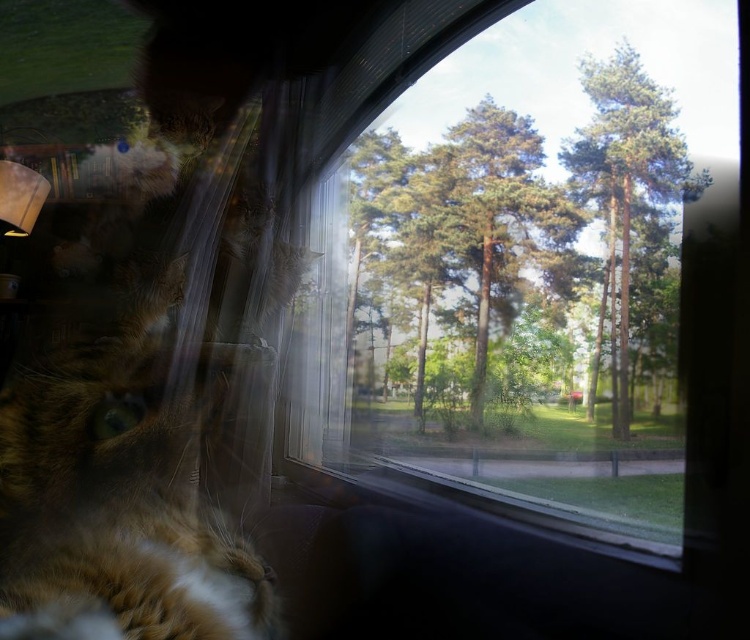
Question: Among these objects, which one is nearest to the camera?

Choices:
 (A) transparent glass window at center
 (B) tabby fur cat at left
 (C) green leafy tree at upper right

Answer: (A)

Question: Does tabby fur cat at left appear over green leafy tree at upper right?

Choices:
 (A) yes
 (B) no

Answer: (B)

Question: Where is tabby fur cat at left located in relation to green leafy tree at upper right in the image?

Choices:
 (A) right
 (B) left

Answer: (B)

Question: Which of the following is the farthest from the observer?

Choices:
 (A) transparent glass window at center
 (B) green leafy tree at upper right
 (C) tabby fur cat at left

Answer: (B)

Question: Where is transparent glass window at center located in relation to green leafy tree at upper right in the image?

Choices:
 (A) below
 (B) above

Answer: (A)

Question: Among these objects, which one is nearest to the camera?

Choices:
 (A) green leafy tree at upper right
 (B) tabby fur cat at left

Answer: (B)